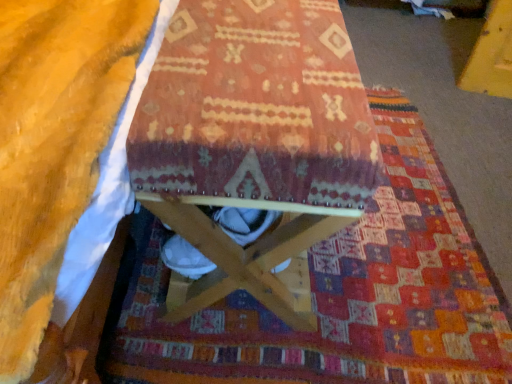
I want to click on vacant area to the right of wooden stool at center, so [412, 238].